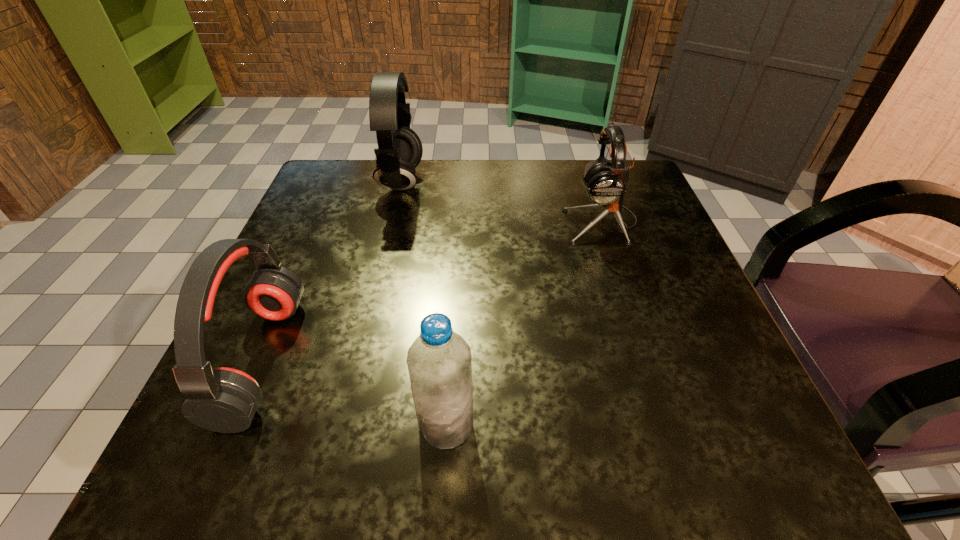
I want to click on vacant space at the far right corner of the desktop, so click(646, 180).

This screenshot has height=540, width=960. I want to click on vacant position at the near right corner of the desktop, so click(x=660, y=451).

I want to click on free spot between the rightmost earphone and the leftmost object, so click(431, 291).

Where is `blank region between the third object from right to left and the third object from left to right`? The image size is (960, 540). blank region between the third object from right to left and the third object from left to right is located at coordinates (424, 303).

At what (x,y) coordinates should I click in order to perform the action: click on free spot between the second earphone from right to left and the leftmost earphone. Please return your answer as a coordinate pair (x, y). Looking at the image, I should click on (331, 271).

I want to click on free space between the second earphone from left to right and the leftmost earphone, so click(x=331, y=271).

Image resolution: width=960 pixels, height=540 pixels. Find the location of `vacant area between the nearest earphone and the third object from right to left`. vacant area between the nearest earphone and the third object from right to left is located at coordinates (331, 271).

This screenshot has width=960, height=540. Identify the location of vacant region between the water bottle and the rightmost object. (524, 323).

Identify the location of empty location between the second object from left to right and the leftmost object. The image size is (960, 540). (331, 271).

Where is `unoccupied area between the nearest earphone and the rightmost object`? This screenshot has height=540, width=960. unoccupied area between the nearest earphone and the rightmost object is located at coordinates (431, 291).